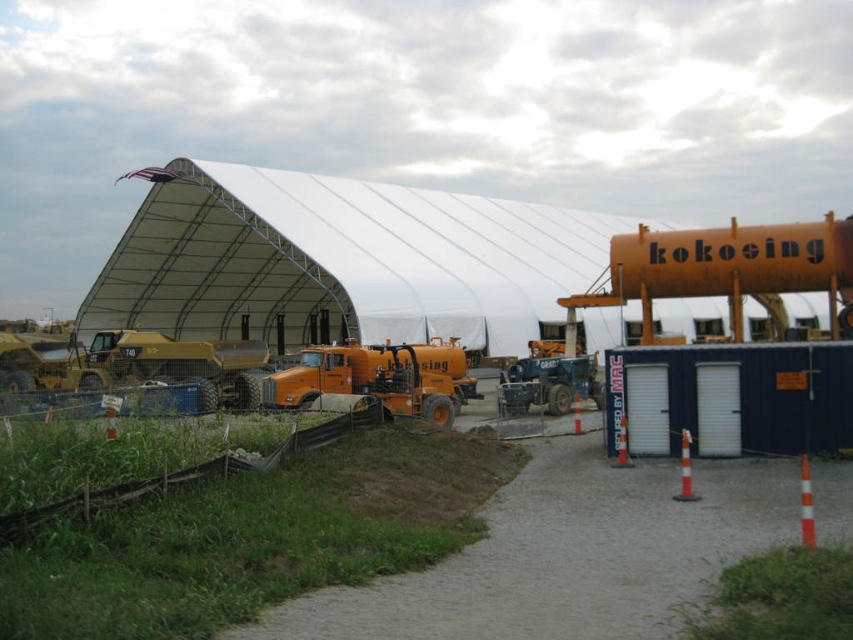
Question: Which point appears closest to the camera in this image?

Choices:
 (A) (537, 388)
 (B) (508, 228)
 (C) (322, 355)

Answer: (C)

Question: Can you confirm if white fabric hangar at center is smaller than orange matte trailer truck at center?

Choices:
 (A) no
 (B) yes

Answer: (A)

Question: Is white fabric hangar at center thinner than orange matte trailer truck at center?

Choices:
 (A) no
 (B) yes

Answer: (A)

Question: Among these points, which one is farthest from the camera?

Choices:
 (A) (573, 364)
 (B) (267, 205)
 (C) (386, 401)

Answer: (B)

Question: Based on their relative distances, which object is nearer to the white fabric hangar at center?

Choices:
 (A) orange matte trailer truck at center
 (B) matte blue trailer truck at center

Answer: (B)

Question: Does white fabric hangar at center have a smaller size compared to orange matte trailer truck at center?

Choices:
 (A) yes
 (B) no

Answer: (B)